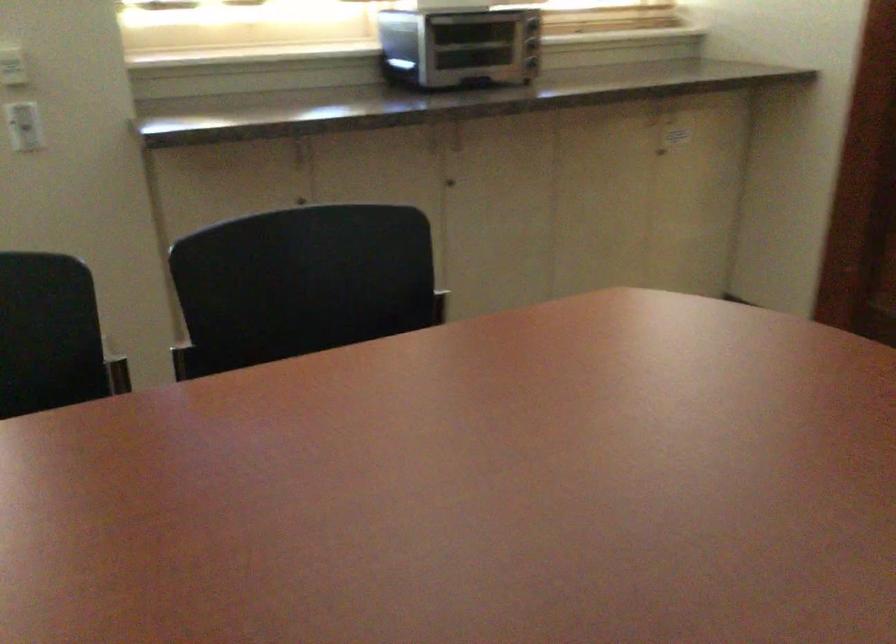
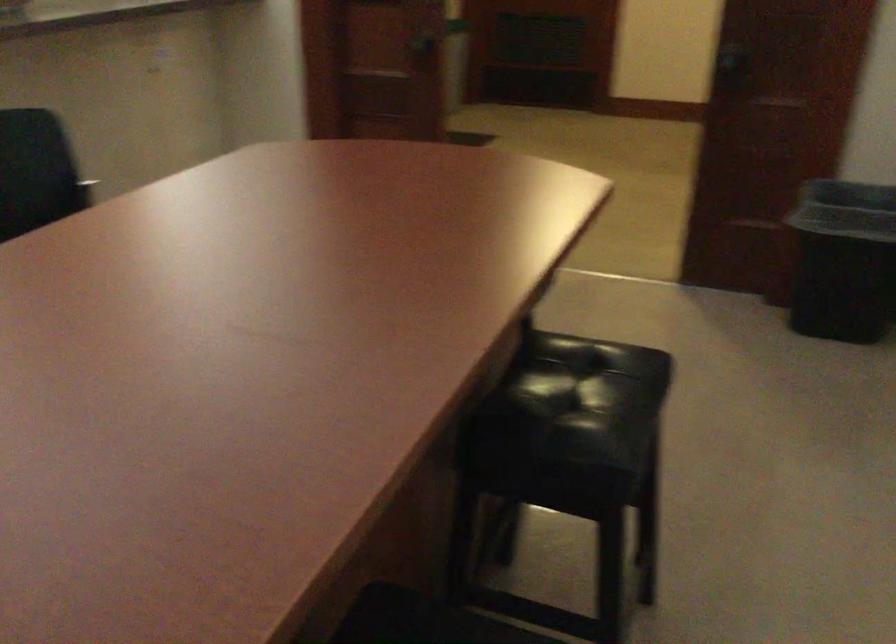
Question: The camera is either moving clockwise (left) or counter-clockwise (right) around the object. The first image is from the beginning of the video and the second image is from the end. Is the camera moving left or right when shooting the video?

Choices:
 (A) Left
 (B) Right

Answer: (A)